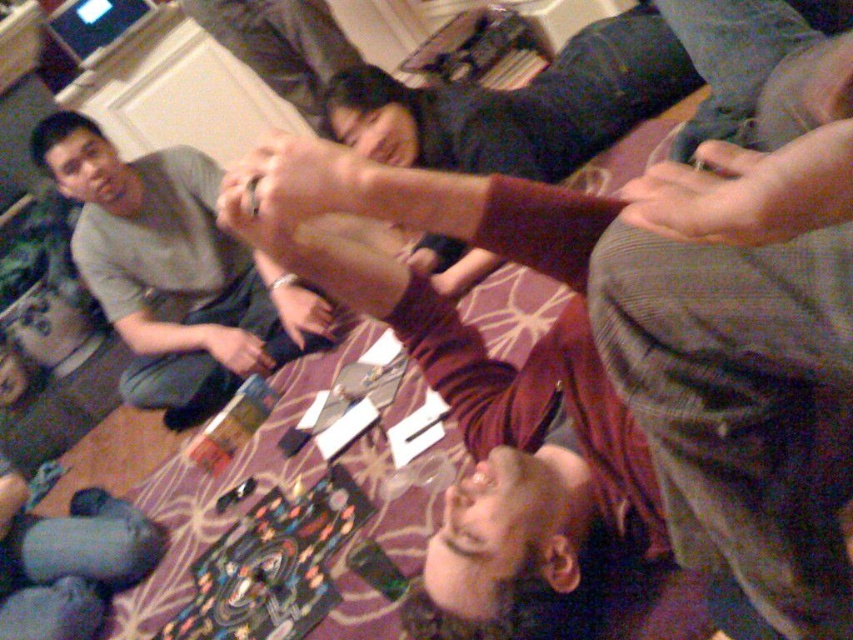
Is maroon sweater at center to the left of dark gray sweater at upper center from the viewer's perspective?

Incorrect, maroon sweater at center is not on the left side of dark gray sweater at upper center.

Is maroon sweater at center further to the viewer compared to dark gray sweater at upper center?

No, it is in front of dark gray sweater at upper center.

At what (x,y) coordinates should I click in order to perform the action: click on maroon sweater at center. Please return your answer as a coordinate pair (x, y). The height and width of the screenshot is (640, 853). Looking at the image, I should click on (519, 106).

You are a GUI agent. You are given a task and a screenshot of the screen. Output one action in this format:
    pyautogui.click(x=<x>, y=<y>)
    Task: Click on the maroon sweater at center
    
    Given the screenshot: What is the action you would take?
    pyautogui.click(x=519, y=106)

Between gray cotton shirt at upper left and dark gray sweater at upper center, which one has more height?

gray cotton shirt at upper left is taller.

Does gray cotton shirt at upper left have a lesser height compared to dark gray sweater at upper center?

In fact, gray cotton shirt at upper left may be taller than dark gray sweater at upper center.

Is point (221, 380) more distant than point (280, 13)?

No, (221, 380) is in front of (280, 13).

The height and width of the screenshot is (640, 853). Find the location of `gray cotton shirt at upper left`. gray cotton shirt at upper left is located at coordinates (173, 272).

Is gray cotton shirt at upper left to the right of maroon sweater at center from the viewer's perspective?

No, gray cotton shirt at upper left is not to the right of maroon sweater at center.

Is gray cotton shirt at upper left smaller than maroon sweater at center?

No, gray cotton shirt at upper left is not smaller than maroon sweater at center.

Is point (286, 298) behind point (582, 65)?

Yes, point (286, 298) is farther from viewer.

You are a GUI agent. You are given a task and a screenshot of the screen. Output one action in this format:
    pyautogui.click(x=<x>, y=<y>)
    Task: Click on the gray cotton shirt at upper left
    
    Given the screenshot: What is the action you would take?
    pyautogui.click(x=173, y=272)